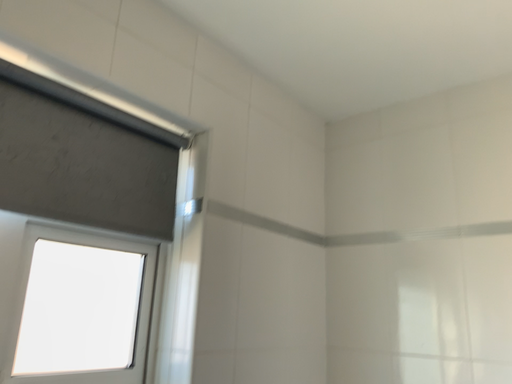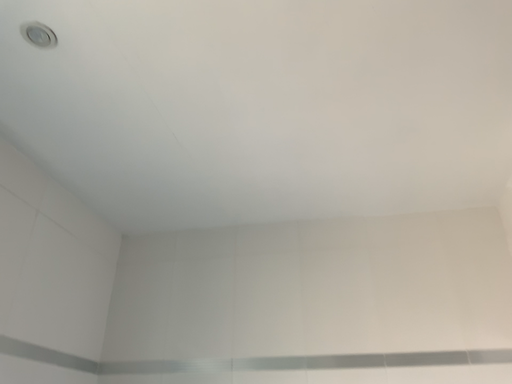
Question: How did the camera likely rotate when shooting the video?

Choices:
 (A) rotated right
 (B) rotated left

Answer: (A)